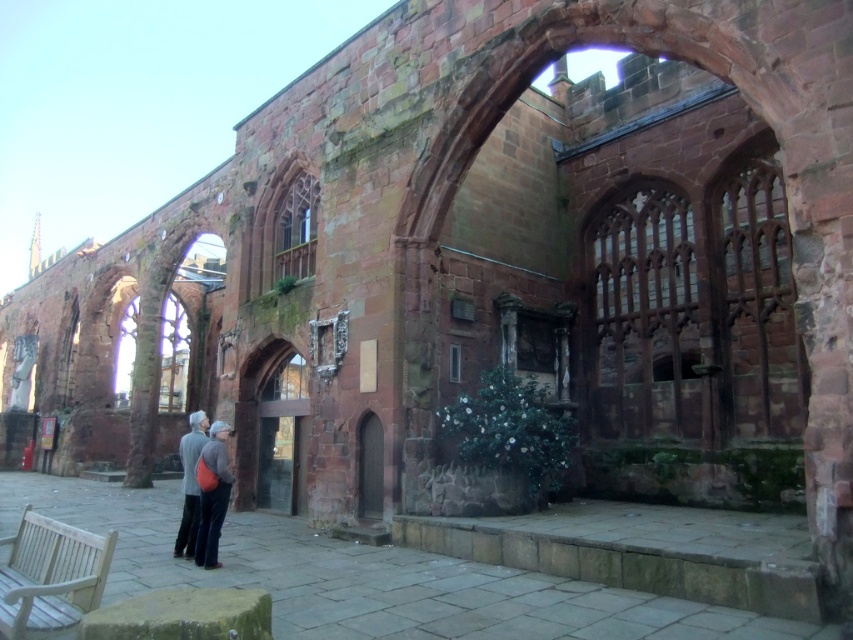
Question: Which point is closer to the camera taking this photo?

Choices:
 (A) pos(204,508)
 (B) pos(190,442)

Answer: (A)

Question: Which object is farther from the camera taking this photo?

Choices:
 (A) white wooden bench at lower left
 (B) gray fabric jacket at center
 (C) matte orange backpack at lower left

Answer: (B)

Question: Can you confirm if white wooden bench at lower left is thinner than matte orange backpack at lower left?

Choices:
 (A) no
 (B) yes

Answer: (A)

Question: Observing the image, what is the correct spatial positioning of white wooden bench at lower left in reference to gray fabric jacket at center?

Choices:
 (A) left
 (B) right

Answer: (B)

Question: Does matte orange backpack at lower left have a lesser width compared to gray fabric jacket at center?

Choices:
 (A) yes
 (B) no

Answer: (A)

Question: Which point appears closest to the camera in this image?

Choices:
 (A) (200, 433)
 (B) (218, 524)
 (C) (26, 589)

Answer: (C)